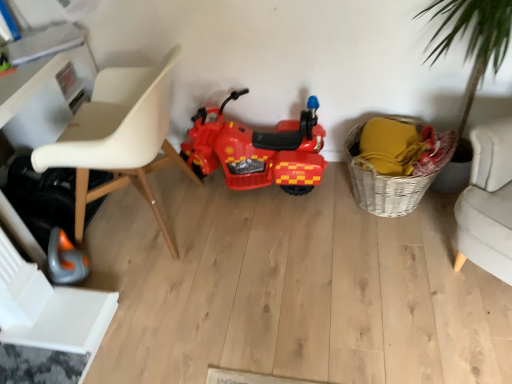
This screenshot has height=384, width=512. Describe the element at coordinates (119, 138) in the screenshot. I see `white plastic chair at left` at that location.

This screenshot has width=512, height=384. Describe the element at coordinates (258, 150) in the screenshot. I see `shiny plastic motorcycle at center` at that location.

Find the location of a particular element. The image size is (512, 384). woven basket at lower right is located at coordinates [x=390, y=179].

Locate an element on the screen. This screenshot has width=512, height=384. white plastic chair at left is located at coordinates (119, 138).

Is white plastic chair at left looking in the opposite direction of shiny plastic motorcycle at center?

No, white plastic chair at left's orientation is not away from shiny plastic motorcycle at center.

Between white plastic chair at left and shiny plastic motorcycle at center, which one has smaller width?

shiny plastic motorcycle at center is thinner.

Based on the photo, what's the angular difference between white plastic chair at left and shiny plastic motorcycle at center's facing directions?

The facing directions of white plastic chair at left and shiny plastic motorcycle at center are 90 degrees apart.

Considering the relative sizes of white plastic chair at left and shiny plastic motorcycle at center in the image provided, is white plastic chair at left taller than shiny plastic motorcycle at center?

Yes, white plastic chair at left is taller than shiny plastic motorcycle at center.

How much distance is there between shiny plastic motorcycle at center and woven basket at lower right?

shiny plastic motorcycle at center and woven basket at lower right are 17.08 inches apart.

Is point (206, 111) in front of point (449, 136)?

That is False.

Consider the image. Is shiny plastic motorcycle at center positioned with its back to woven basket at lower right?

That's not correct — shiny plastic motorcycle at center is not looking away from woven basket at lower right.

Does shiny plastic motorcycle at center come behind woven basket at lower right?

Yes, shiny plastic motorcycle at center is behind woven basket at lower right.

Is woven basket at lower right not inside white plastic chair at left?

Yes, woven basket at lower right is outside of white plastic chair at left.

Is woven basket at lower right wider or thinner than white plastic chair at left?

In the image, woven basket at lower right appears to be more narrow than white plastic chair at left.

Based on the photo, measure the distance from woven basket at lower right to white plastic chair at left.

1.04 meters.

Considering the sizes of objects woven basket at lower right and white plastic chair at left in the image provided, who is bigger, woven basket at lower right or white plastic chair at left?

With larger size is white plastic chair at left.

Could you tell me if white plastic swivel chair at lower left is facing white plastic chair at left?

No, white plastic swivel chair at lower left is not aimed at white plastic chair at left.

Considering the relative sizes of white plastic swivel chair at lower left and white plastic chair at left in the image provided, is white plastic swivel chair at lower left taller than white plastic chair at left?

No.

From the image's perspective, is white plastic swivel chair at lower left positioned above or below white plastic chair at left?

Based on their image positions, white plastic swivel chair at lower left is located beneath white plastic chair at left.

Is point (65, 287) positioned behind point (113, 172)?

No, (65, 287) is closer to viewer.

From the image's perspective, is woven basket at lower right beneath white plastic swivel chair at lower left?

Incorrect, from the image's perspective, woven basket at lower right is higher than white plastic swivel chair at lower left.

Considering the positions of objects woven basket at lower right and white plastic swivel chair at lower left in the image provided, who is more to the right, woven basket at lower right or white plastic swivel chair at lower left?

woven basket at lower right.

Does point (450, 143) appear closer or farther from the camera than point (71, 296)?

Point (450, 143) is positioned farther from the camera compared to point (71, 296).

Is woven basket at lower right outside of white plastic swivel chair at lower left?

woven basket at lower right is positioned outside white plastic swivel chair at lower left.

Who is taller, white plastic swivel chair at lower left or woven basket at lower right?

With more height is woven basket at lower right.

Does point (7, 305) appear closer or farther from the camera than point (358, 201)?

Point (7, 305) appears to be closer to the viewer than point (358, 201).

Would you say woven basket at lower right is part of white plastic swivel chair at lower left's contents?

No, woven basket at lower right is not surrounded by white plastic swivel chair at lower left.

From the image's perspective, relative to woven basket at lower right, is white plastic swivel chair at lower left above or below?

Clearly, from the image's perspective, white plastic swivel chair at lower left is below woven basket at lower right.

Is white plastic chair at left facing towards white plastic swivel chair at lower left?

No, white plastic chair at left does not turn towards white plastic swivel chair at lower left.

The width and height of the screenshot is (512, 384). In order to click on swivel chair on the left of white plastic chair at left in this screenshot , I will do `click(49, 310)`.

Based on the photo, from a real-world perspective, is white plastic chair at left physically above white plastic swivel chair at lower left?

Yes, from a real-world perspective, white plastic chair at left is on top of white plastic swivel chair at lower left.

Considering the sizes of white plastic chair at left and white plastic swivel chair at lower left in the image, is white plastic chair at left wider or thinner than white plastic swivel chair at lower left?

white plastic chair at left is wider than white plastic swivel chair at lower left.

You are a GUI agent. You are given a task and a screenshot of the screen. Output one action in this format:
    pyautogui.click(x=<x>, y=<y>)
    Task: Click on the land vehicle beneath the white plastic chair at left (from a real-world perspective)
    This screenshot has width=512, height=384.
    Given the screenshot: What is the action you would take?
    pyautogui.click(x=258, y=150)

I want to click on basket lying on the right of shiny plastic motorcycle at center, so click(390, 179).

Considering their positions, is shiny plastic motorcycle at center positioned further to woven basket at lower right than white plastic chair at left?

The object further to woven basket at lower right is white plastic chair at left.

Which object lies nearer to the anchor point shiny plastic motorcycle at center, white plastic swivel chair at lower left or woven basket at lower right?

The object closer to shiny plastic motorcycle at center is woven basket at lower right.

Looking at the image, which one is located further to shiny plastic motorcycle at center, woven basket at lower right or white plastic swivel chair at lower left?

white plastic swivel chair at lower left lies further to shiny plastic motorcycle at center than the other object.

Consider the image. When comparing their distances from shiny plastic motorcycle at center, does white plastic chair at left or woven basket at lower right seem closer?

woven basket at lower right.

Based on their spatial positions, is white plastic swivel chair at lower left or shiny plastic motorcycle at center further from white plastic chair at left?

Among the two, white plastic swivel chair at lower left is located further to white plastic chair at left.

Based on their spatial positions, is shiny plastic motorcycle at center or white plastic swivel chair at lower left closer to white plastic chair at left?

shiny plastic motorcycle at center.

Consider the image. Which object lies further to the anchor point shiny plastic motorcycle at center, white plastic swivel chair at lower left or white plastic chair at left?

white plastic swivel chair at lower left is positioned further to the anchor shiny plastic motorcycle at center.

Based on their spatial positions, is white plastic chair at left or shiny plastic motorcycle at center closer to woven basket at lower right?

Among the two, shiny plastic motorcycle at center is located nearer to woven basket at lower right.

You are a GUI agent. You are given a task and a screenshot of the screen. Output one action in this format:
    pyautogui.click(x=<x>, y=<y>)
    Task: Click on the land vehicle between white plastic swivel chair at lower left and woven basket at lower right from left to right
    This screenshot has width=512, height=384.
    Given the screenshot: What is the action you would take?
    258,150

In order to click on chair between white plastic swivel chair at lower left and woven basket at lower right in the horizontal direction in this screenshot , I will do `click(119, 138)`.

At what (x,y) coordinates should I click in order to perform the action: click on chair that lies between shiny plastic motorcycle at center and white plastic swivel chair at lower left from top to bottom. Please return your answer as a coordinate pair (x, y). Looking at the image, I should click on (119, 138).

Identify the location of land vehicle situated between white plastic chair at left and woven basket at lower right from left to right. (258, 150).